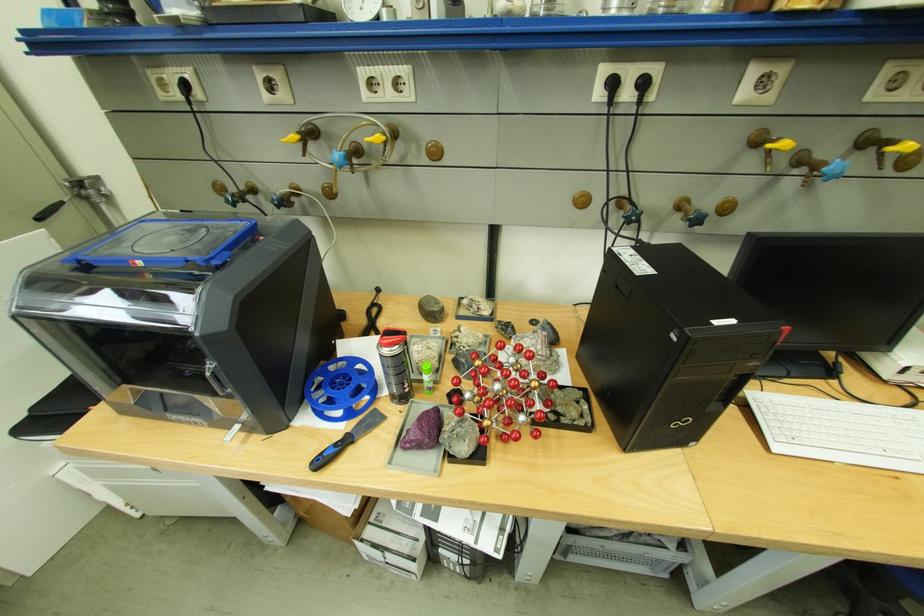
Find where to lift the small green bottle. Please return your answer as a coordinate pair (x, y).

(427, 377)